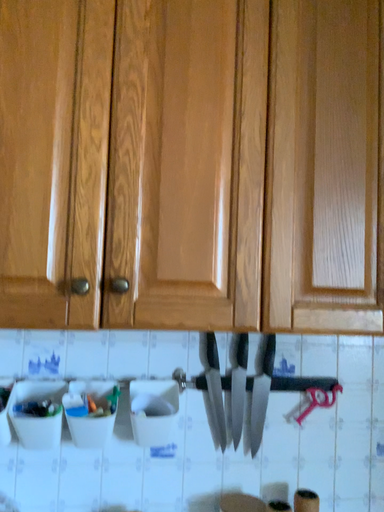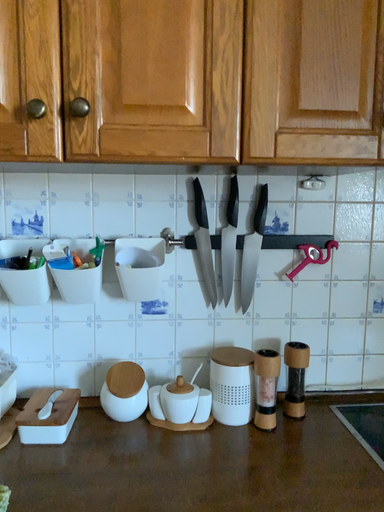
Question: Which way did the camera rotate in the video?

Choices:
 (A) rotated upward
 (B) rotated downward

Answer: (B)